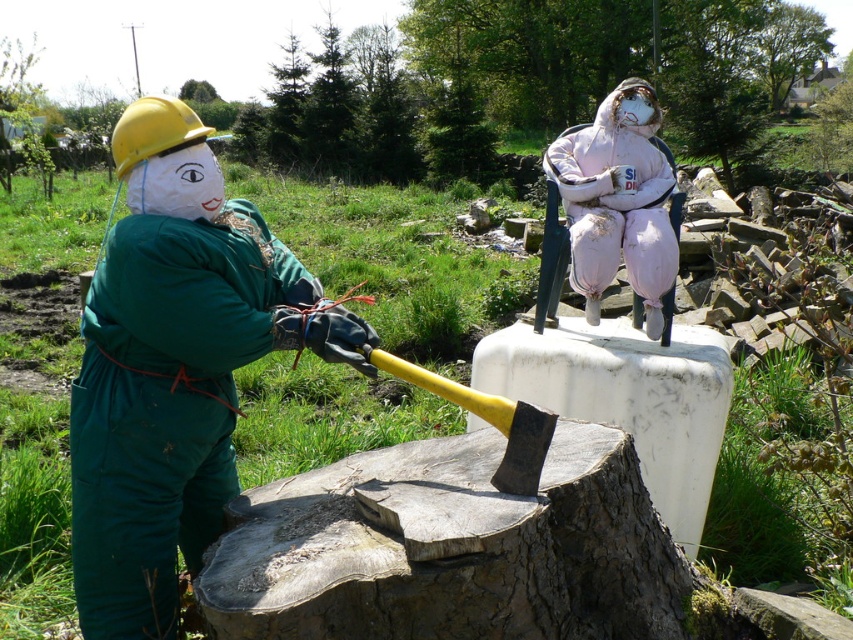
Consider the image. You are a photographer planning to take a group photo of the green fabric figure at left and the pink fabric figure at upper center. Since you want both to appear equally sized in the photo, which figure should you move closer to the camera and why?

The pink fabric figure at upper center should be moved closer to the camera because it is smaller in size compared to the green fabric figure at left. By moving the smaller figure closer, their sizes in the photo will appear more balanced.

You are a photographer wanting to capture both the green fabric figure at left and the pink fabric figure at upper center in the same frame. Based on their sizes, which figure should you position closer to the camera to make them appear similar in size?

Since the green fabric figure at left is much taller than the pink fabric figure at upper center, you should position the pink fabric figure at upper center closer to the camera to balance their apparent sizes.